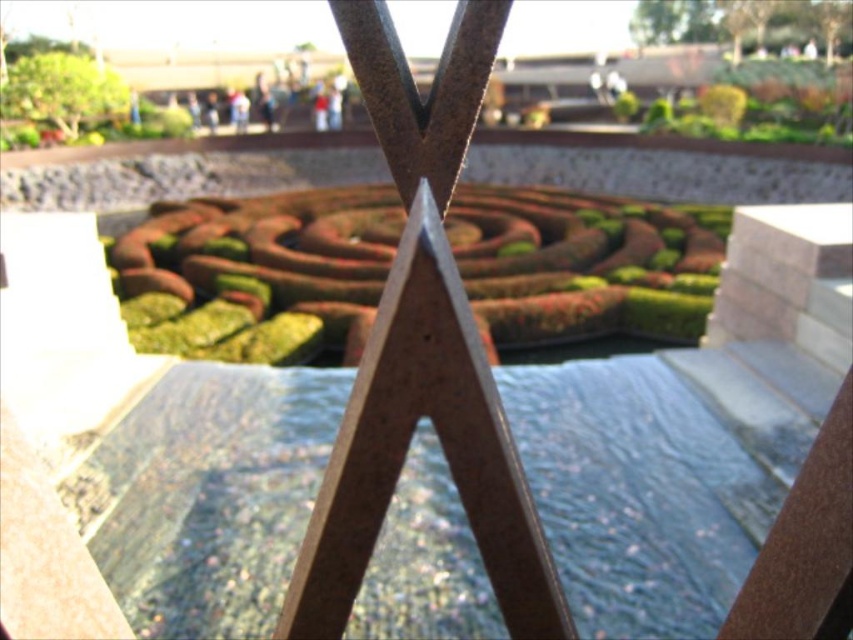
You are standing in the garden and want to take a photo of both the clear glass water at center and the green mossy hedge at center. Which object should you focus on first to ensure both are in sharp focus?

You should focus on the green mossy hedge at center first because it is farther away than the clear glass water at center, allowing the camera to capture both objects in focus by adjusting the depth of field accordingly.

You are standing in the garden and want to take a photo of both the green mossy hedge at center and the green textured hedge at upper left. Which hedge should you focus on first to ensure both are in sharp focus?

You should focus on the green mossy hedge at center first because it is closer to you than the green textured hedge at upper left, so adjusting focus from near to far will help both be in sharp focus.